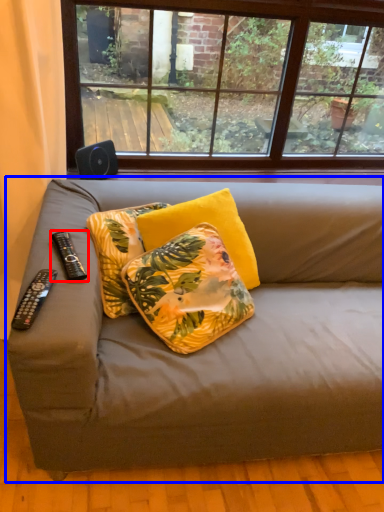
Question: Which of the following is the closest to the observer, remote control (highlighted by a red box) or studio couch (highlighted by a blue box)?

Choices:
 (A) remote control
 (B) studio couch

Answer: (B)